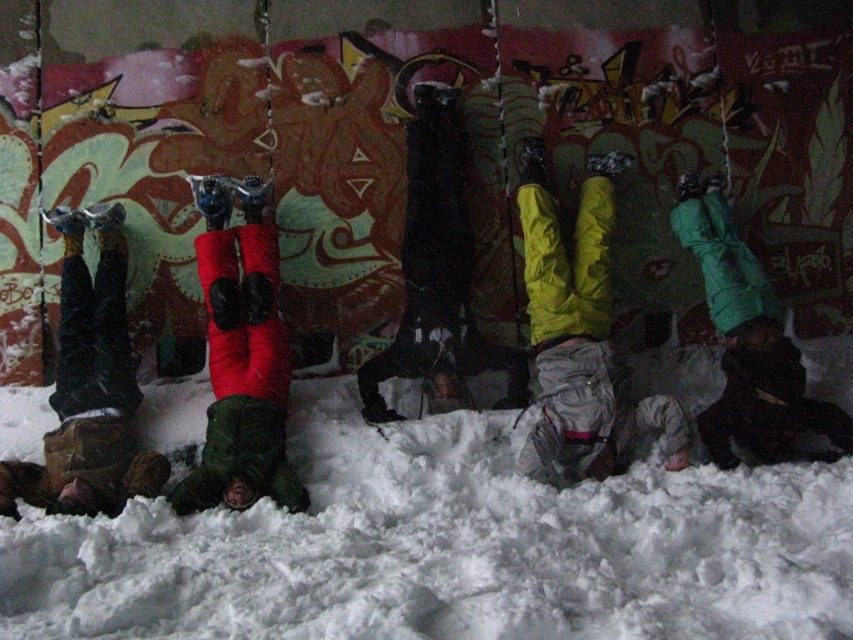
You are a photographer taking a picture of the red fabric pants at center and the green matte jacket at center. Which object should you focus on first to ensure both are in clear view?

You should focus on the red fabric pants at center first since it is closer to the viewer than the green matte jacket at center, ensuring both are in clear focus.

You are an observer standing in front of the snowy scene. You notice two pairs of red fabric pants at center and red fabric pants at left. Which pair of red fabric pants takes up more space in the image?

The red fabric pants at left takes up more space in the image than the red fabric pants at center because the red fabric pants at center occupies less space than red fabric pants at left.